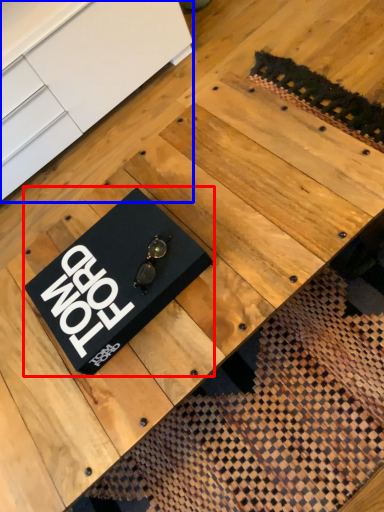
Question: Among these objects, which one is nearest to the camera, plaque (highlighted by a red box) or furniture (highlighted by a blue box)?

Choices:
 (A) plaque
 (B) furniture

Answer: (A)